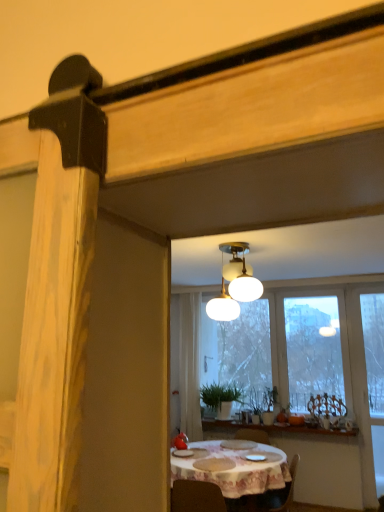
The height and width of the screenshot is (512, 384). What do you see at coordinates (281, 342) in the screenshot? I see `transparent glass window at center` at bounding box center [281, 342].

This screenshot has height=512, width=384. What do you see at coordinates (221, 395) in the screenshot?
I see `green matte plant at center` at bounding box center [221, 395].

This screenshot has width=384, height=512. Describe the element at coordinates (190, 365) in the screenshot. I see `white sheer curtain at center` at that location.

In order to click on white frosted glass lamp at upper center in this screenshot , I will do `click(234, 284)`.

Is white ceramic window sill at center not near transparent glass window at center?

Indeed, white ceramic window sill at center is not near transparent glass window at center.

Between white ceramic window sill at center and transparent glass window at center, which one has less height?

white ceramic window sill at center is shorter.

From the image's perspective, is white ceramic window sill at center positioned above or below transparent glass window at center?

white ceramic window sill at center is below transparent glass window at center.

Which object is positioned more to the right, white ceramic window sill at center or transparent glass window at center?

Positioned to the right is transparent glass window at center.

Do you think green matte plant at center is within white cloth-covered table at center, or outside of it?

green matte plant at center cannot be found inside white cloth-covered table at center.

Based on the photo, which object is positioned more to the left, green matte plant at center or white cloth-covered table at center?

white cloth-covered table at center.

Does green matte plant at center have a smaller size compared to white cloth-covered table at center?

Yes.

From a real-world perspective, is transparent glass window at center below white cloth-covered table at center?

No, from a real-world perspective, transparent glass window at center is not below white cloth-covered table at center.

Does transparent glass window at center turn towards white cloth-covered table at center?

Yes, transparent glass window at center is aimed at white cloth-covered table at center.

How far apart are transparent glass window at center and white cloth-covered table at center?

They are 1.99 meters apart.

Considering the relative positions of transparent glass window at center and white cloth-covered table at center in the image provided, is transparent glass window at center to the left of white cloth-covered table at center from the viewer's perspective?

No, transparent glass window at center is not to the left of white cloth-covered table at center.

How distant is white ceramic window sill at center from white cloth-covered table at center?

white ceramic window sill at center and white cloth-covered table at center are 33.25 inches apart.

Which is in front, point (260, 428) or point (254, 470)?

The point (254, 470) is in front.

From the image's perspective, is white ceramic window sill at center beneath white cloth-covered table at center?

Incorrect, from the image's perspective, white ceramic window sill at center is higher than white cloth-covered table at center.

Can you confirm if white ceramic window sill at center is smaller than white cloth-covered table at center?

Yes.

Between transparent glass window at center and green matte plant at center, which one has larger width?

Wider between the two is green matte plant at center.

Between transparent glass window at center and green matte plant at center, which one has larger size?

Bigger between the two is transparent glass window at center.

From the image's perspective, which is below, transparent glass window at center or green matte plant at center?

green matte plant at center, from the image's perspective.

How much distance is there between transparent glass window at center and green matte plant at center?

transparent glass window at center and green matte plant at center are 73.93 centimeters apart.

Does transparent glass window at center have a lesser width compared to white ceramic window sill at center?

Indeed, transparent glass window at center has a lesser width compared to white ceramic window sill at center.

Between point (214, 366) and point (309, 431), which one is positioned in front?

Positioned in front is point (309, 431).

Considering the positions of objects transparent glass window at center and white ceramic window sill at center in the image provided, who is behind, transparent glass window at center or white ceramic window sill at center?

transparent glass window at center is more distant.

Which point is more distant from viewer, (315, 429) or (181, 402)?

The point (181, 402) is more distant.

At what (x,y) coordinates should I click in order to perform the action: click on window sill that appears in front of the white sheer curtain at center. Please return your answer as a coordinate pair (x, y). This screenshot has height=512, width=384. Looking at the image, I should click on (267, 429).

From the image's perspective, would you say white ceramic window sill at center is shown under white sheer curtain at center?

Yes, from the image's perspective, white ceramic window sill at center is beneath white sheer curtain at center.

Considering the sizes of objects white ceramic window sill at center and white sheer curtain at center in the image provided, who is shorter, white ceramic window sill at center or white sheer curtain at center?

With less height is white ceramic window sill at center.

In the image, there is a white ceramic window sill at center. At what (x,y) coordinates should I click in order to perform the action: click on window above it (from the image's perspective). Please return your answer as a coordinate pair (x, y). Looking at the image, I should click on (281, 342).

I want to click on kitchen & dining room table that is under the green matte plant at center (from a real-world perspective), so click(x=239, y=474).

From the image, which object appears to be nearer to green matte plant at center, white sheer curtain at center or white frosted glass lamp at upper center?

Among the two, white sheer curtain at center is located nearer to green matte plant at center.

Which object lies nearer to the anchor point white frosted glass lamp at upper center, white sheer curtain at center or green matte plant at center?

A: white sheer curtain at center is positioned closer to the anchor white frosted glass lamp at upper center.

Based on their spatial positions, is transparent glass window at center or white frosted glass lamp at upper center closer to white sheer curtain at center?

The object closer to white sheer curtain at center is transparent glass window at center.

Considering their positions, is green matte plant at center positioned closer to white frosted glass lamp at upper center than white sheer curtain at center?

white sheer curtain at center is positioned closer to the anchor white frosted glass lamp at upper center.

Based on their spatial positions, is green matte plant at center or transparent glass window at center closer to white sheer curtain at center?

green matte plant at center is positioned closer to the anchor white sheer curtain at center.

Considering their positions, is white cloth-covered table at center positioned closer to white ceramic window sill at center than green matte plant at center?

The object closer to white ceramic window sill at center is green matte plant at center.

Based on their spatial positions, is transparent glass window at center or white cloth-covered table at center closer to white sheer curtain at center?

The object closer to white sheer curtain at center is transparent glass window at center.

Which object lies nearer to the anchor point white cloth-covered table at center, white sheer curtain at center or transparent glass window at center?

white sheer curtain at center is closer to white cloth-covered table at center.

This screenshot has width=384, height=512. In order to click on window between white frosted glass lamp at upper center and green matte plant at center from front to back in this screenshot , I will do `click(281, 342)`.

Locate an element on the screen. The image size is (384, 512). window sill between white cloth-covered table at center and green matte plant at center along the z-axis is located at coordinates (267, 429).

Where is `plant situated between white sheer curtain at center and white ceramic window sill at center from left to right`? This screenshot has width=384, height=512. plant situated between white sheer curtain at center and white ceramic window sill at center from left to right is located at coordinates (221, 395).

Identify the location of plant that lies between transparent glass window at center and white ceramic window sill at center from top to bottom. (221, 395).